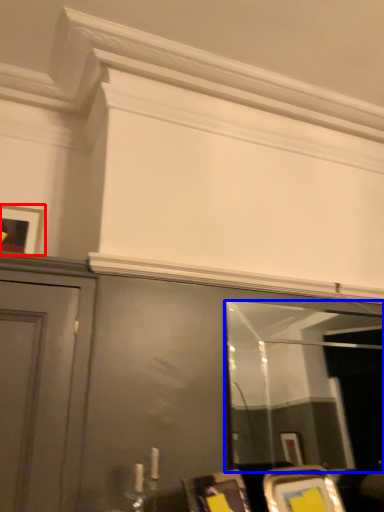
Question: Which object is further to the camera taking this photo, picture frame (highlighted by a red box) or mirror (highlighted by a blue box)?

Choices:
 (A) picture frame
 (B) mirror

Answer: (A)